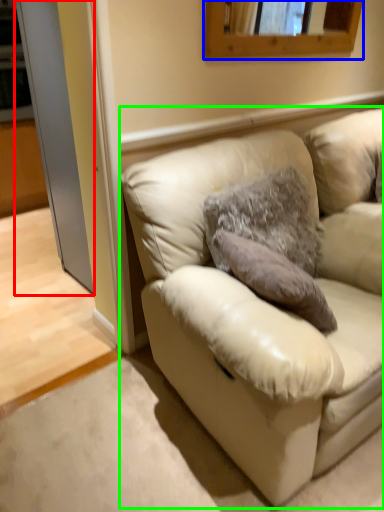
Question: Which object is the closest to the glass door (highlighted by a red box)? Choose among these: mirror (highlighted by a blue box) or studio couch (highlighted by a green box).

Choices:
 (A) mirror
 (B) studio couch

Answer: (A)